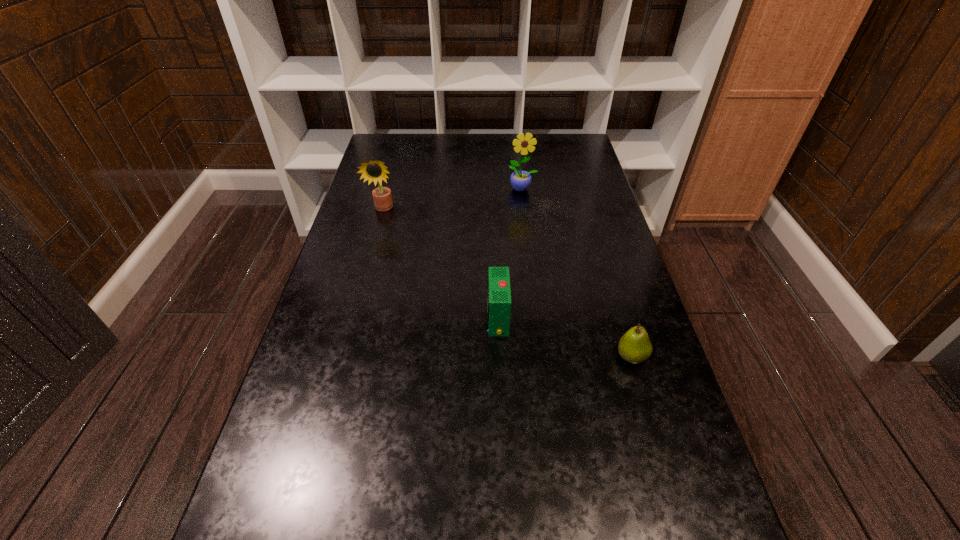
Identify the location of free space located 0.400m on the front-facing side of the alarm clock. (320, 319).

At what (x,y) coordinates should I click in order to perform the action: click on vacant space positioned 0.260m on the front-facing side of the alarm clock. Please return your answer as a coordinate pair (x, y). The width and height of the screenshot is (960, 540). Looking at the image, I should click on (378, 319).

At what (x,y) coordinates should I click in order to perform the action: click on vacant space located 0.380m on the front-facing side of the alarm clock. Please return your answer as a coordinate pair (x, y). This screenshot has width=960, height=540. Looking at the image, I should click on (328, 319).

The width and height of the screenshot is (960, 540). In order to click on blank space located on the left of the pear in this screenshot , I will do `click(512, 357)`.

Find the location of a particular element. This screenshot has height=540, width=960. object at the left edge is located at coordinates pyautogui.click(x=375, y=171).

Identify the location of object that is at the right edge. (634, 346).

I want to click on vacant space at the left edge of the desktop, so click(290, 458).

I want to click on vacant space at the right edge of the desktop, so click(x=717, y=511).

Where is `vacant area at the far left corner of the desktop`? vacant area at the far left corner of the desktop is located at coordinates (382, 148).

Find the location of `vacant space at the far right corner of the desktop`. vacant space at the far right corner of the desktop is located at coordinates (570, 143).